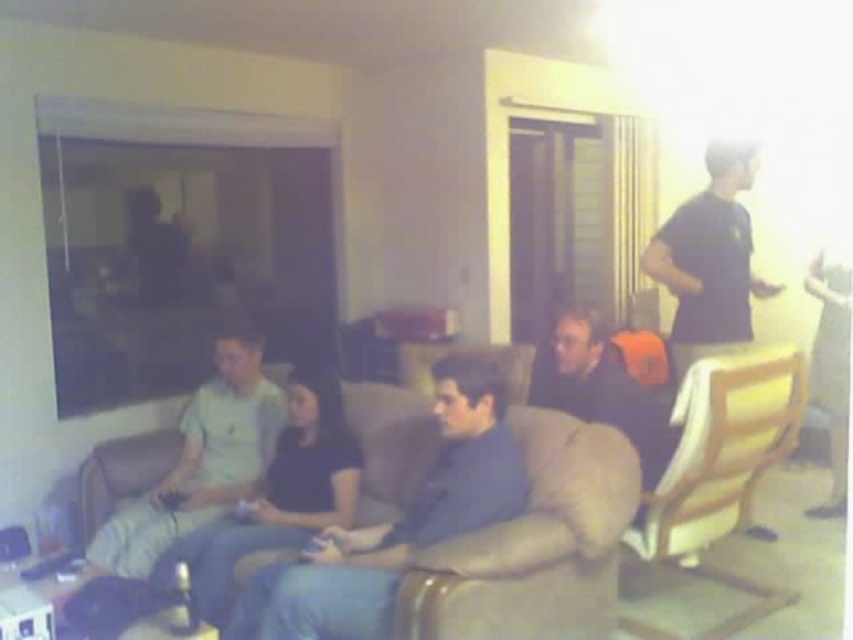
Does light green fabric shirt at left appear under dark blue shirt at center?

Indeed, light green fabric shirt at left is positioned under dark blue shirt at center.

Where is `light green fabric shirt at left`? Image resolution: width=853 pixels, height=640 pixels. light green fabric shirt at left is located at coordinates (202, 458).

Which is behind, point (235, 429) or point (534, 356)?

Positioned behind is point (534, 356).

Locate an element on the screen. The width and height of the screenshot is (853, 640). light green fabric shirt at left is located at coordinates (202, 458).

Is black matte shirt at upper right further to camera compared to dark blue shirt at center?

Yes, black matte shirt at upper right is further from the viewer.

Based on the photo, can you confirm if black matte shirt at upper right is smaller than dark blue shirt at center?

No.

Does point (721, 269) come behind point (602, 381)?

Yes, point (721, 269) is farther from viewer.

Find the location of `black matte shirt at upper right`. black matte shirt at upper right is located at coordinates (709, 257).

Can you confirm if blue fabric couch at center is positioned to the right of light green fabric shirt at left?

Indeed, blue fabric couch at center is positioned on the right side of light green fabric shirt at left.

Does blue fabric couch at center appear over light green fabric shirt at left?

Actually, blue fabric couch at center is below light green fabric shirt at left.

The width and height of the screenshot is (853, 640). What are the coordinates of `blue fabric couch at center` in the screenshot? It's located at (396, 524).